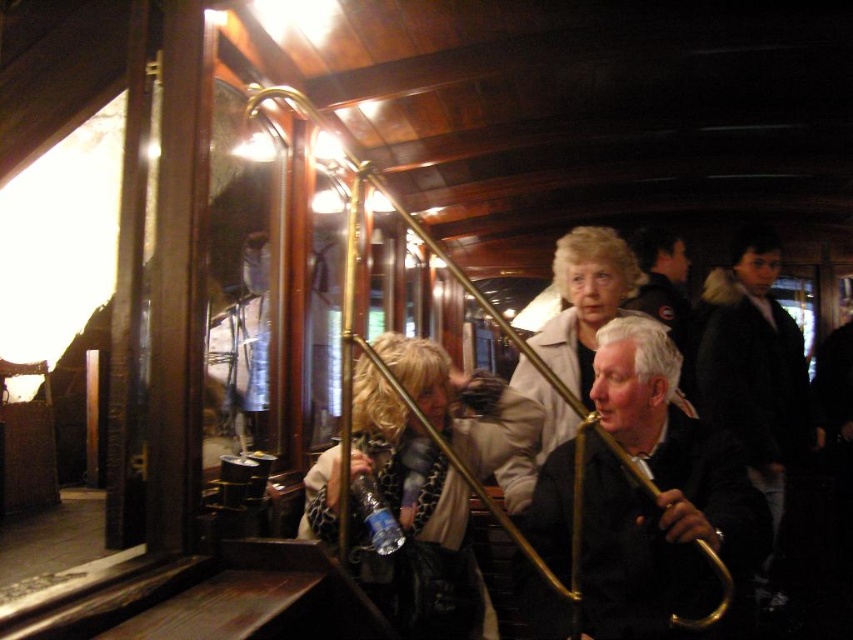
Is point (352, 381) farther from viewer compared to point (517, 460)?

No, it is in front of (517, 460).

Does leopard print scarf at center appear on the left side of white textured coat at center?

Correct, you'll find leopard print scarf at center to the left of white textured coat at center.

Is point (368, 420) closer to viewer compared to point (598, 264)?

Yes, it is.

Where is `leopard print scarf at center`? Image resolution: width=853 pixels, height=640 pixels. leopard print scarf at center is located at coordinates (462, 403).

Between point (766, 552) and point (541, 339), which one is positioned behind?

Point (541, 339)

Measure the distance between point (619,593) and camera.

A distance of 1.91 meters exists between point (619,593) and camera.

Which is behind, point (654, 328) or point (534, 461)?

Positioned behind is point (534, 461).

You are a GUI agent. You are given a task and a screenshot of the screen. Output one action in this format:
    pyautogui.click(x=<x>, y=<y>)
    Task: Click on the black leather jacket at center
    
    Given the screenshot: What is the action you would take?
    pyautogui.click(x=660, y=500)

Does black leather jacket at center come behind leopard print scarf at center?

No, black leather jacket at center is closer to the viewer.

From the picture: Who is positioned more to the right, black leather jacket at center or leopard print scarf at center?

black leather jacket at center is more to the right.

Based on the photo, who is more distant from viewer, (602, 417) or (390, 419)?

The point (390, 419) is behind.

Locate an element on the screen. The image size is (853, 640). black leather jacket at center is located at coordinates (660, 500).